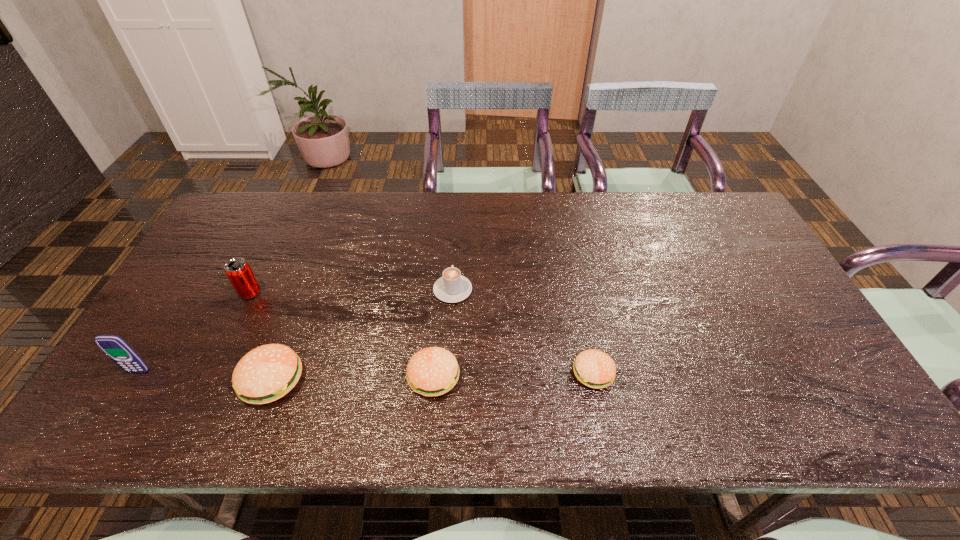
The width and height of the screenshot is (960, 540). I want to click on free space between the cellular telephone and the rightmost object, so click(366, 373).

This screenshot has height=540, width=960. What are the coordinates of `unoccupied area between the rightmost patty and the leftmost object` in the screenshot? It's located at (366, 373).

Identify the location of object that is the third closest to the leftmost patty. The image size is (960, 540). (433, 371).

Identify the location of object that stands as the third closest to the second tallest patty. The width and height of the screenshot is (960, 540). (594, 368).

Find the location of `patty object that ranks as the closest to the shortest patty`. patty object that ranks as the closest to the shortest patty is located at coordinates (433, 371).

Locate an element on the screen. Image resolution: width=960 pixels, height=540 pixels. the second closest patty to the second patty from left to right is located at coordinates (594, 368).

Identify the location of free space that satisfies the following two spatial constraints: 1. on the front-facing side of the cellular telephone; 2. on the right side of the second shortest patty. (135, 377).

This screenshot has width=960, height=540. Identify the location of free space that satisfies the following two spatial constraints: 1. on the front-facing side of the leftmost object; 2. on the right side of the third object from left to right. (133, 380).

The image size is (960, 540). I want to click on free space that satisfies the following two spatial constraints: 1. on the front-facing side of the leftmost patty; 2. on the right side of the leftmost object, so click(133, 380).